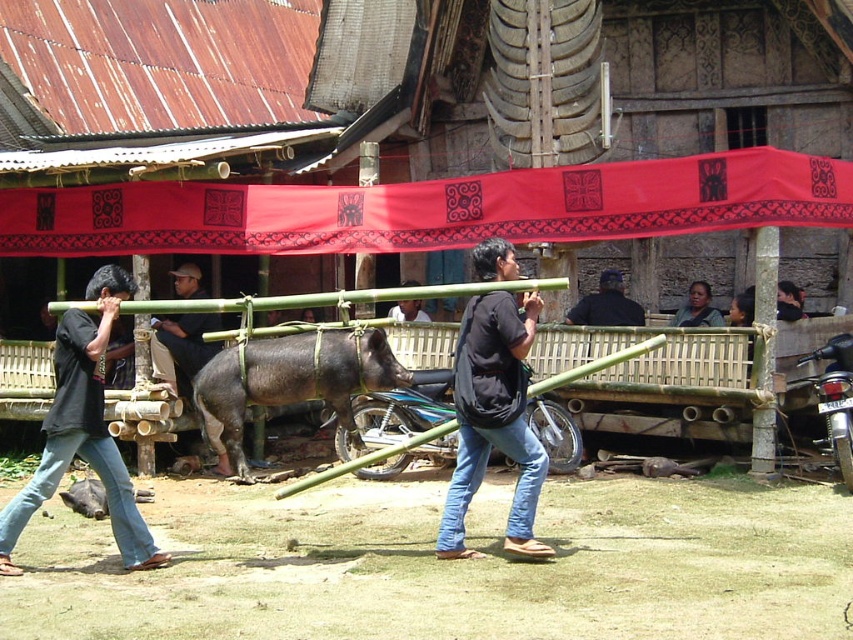
Question: Which point is closer to the camera taking this photo?

Choices:
 (A) (511, 550)
 (B) (207, 321)

Answer: (A)

Question: Which of these objects is positioned closest to the dark brown skin at center?

Choices:
 (A) dark blue shirt at center
 (B) red fabric banner at upper center
 (C) black matte pig at center
 (D) dark brown leather cap at upper center

Answer: (A)

Question: Can you confirm if black shirt at center is positioned to the left of black matte pig at center?

Choices:
 (A) no
 (B) yes

Answer: (B)

Question: Does dark brown leather cap at upper center have a greater width compared to dark brown skin at center?

Choices:
 (A) yes
 (B) no

Answer: (A)

Question: Which of the following is the closest to the observer?

Choices:
 (A) (688, 296)
 (B) (181, 266)
 (C) (515, 340)
 (D) (392, 307)

Answer: (C)

Question: Is red fabric banner at upper center to the right of dark blue shirt at center from the viewer's perspective?

Choices:
 (A) no
 (B) yes

Answer: (A)